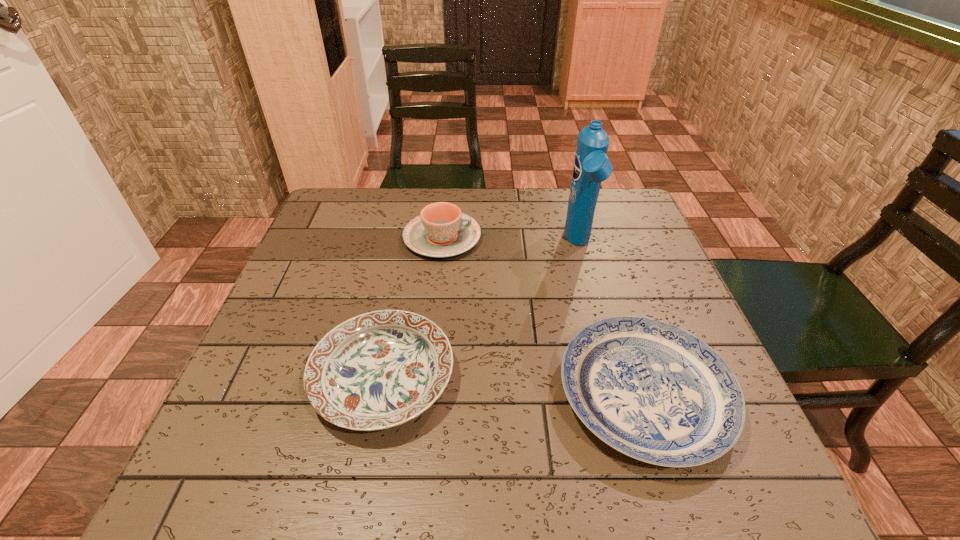
Where is `object at the left edge`? This screenshot has height=540, width=960. object at the left edge is located at coordinates (381, 369).

You are a GUI agent. You are given a task and a screenshot of the screen. Output one action in this format:
    pyautogui.click(x=<x>, y=<y>)
    Task: Click on the object present at the right edge
    
    Given the screenshot: What is the action you would take?
    pyautogui.click(x=649, y=389)

Find the location of a particular element. This screenshot has width=960, height=540. object present at the near left corner is located at coordinates (381, 369).

In order to click on object that is positioned at the near right corner in this screenshot , I will do `click(649, 389)`.

Where is `free space at the far edge`? free space at the far edge is located at coordinates (410, 194).

This screenshot has width=960, height=540. I want to click on vacant area at the left edge, so (x=238, y=402).

In the image, there is a desktop. Identify the location of vacant region at the right edge. This screenshot has width=960, height=540. (656, 306).

In the image, there is a desktop. Where is `vacant region at the far left corner`? This screenshot has height=540, width=960. vacant region at the far left corner is located at coordinates (343, 234).

Image resolution: width=960 pixels, height=540 pixels. I want to click on free space at the far right corner of the desktop, so click(x=592, y=234).

Where is `free spot between the left plate and the right plate`? The width and height of the screenshot is (960, 540). free spot between the left plate and the right plate is located at coordinates (514, 386).